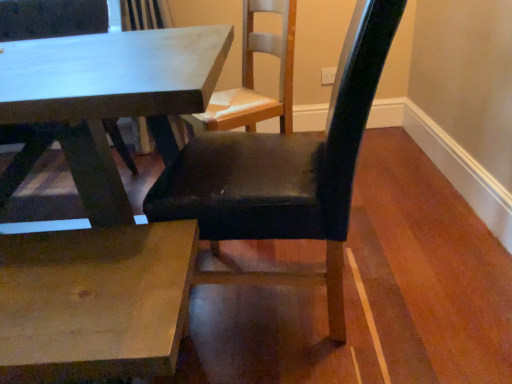
Question: Should I look upward or downward to see smooth white table at center?

Choices:
 (A) down
 (B) up

Answer: (B)

Question: Does black leather chair at center have a lesser height compared to smooth white table at center?

Choices:
 (A) yes
 (B) no

Answer: (B)

Question: From the image's perspective, does black leather chair at center appear lower than smooth white table at center?

Choices:
 (A) no
 (B) yes

Answer: (A)

Question: Is black leather chair at center at the right side of smooth white table at center?

Choices:
 (A) yes
 (B) no

Answer: (A)

Question: Is smooth white table at center at the back of black leather chair at center?

Choices:
 (A) yes
 (B) no

Answer: (B)

Question: Is black leather chair at center taller than smooth white table at center?

Choices:
 (A) no
 (B) yes

Answer: (B)

Question: Can you confirm if black leather chair at center is wider than smooth white table at center?

Choices:
 (A) no
 (B) yes

Answer: (A)

Question: Is smooth white table at center bigger than black leather chair at center?

Choices:
 (A) yes
 (B) no

Answer: (A)

Question: Is smooth white table at center to the right of black leather chair at center from the viewer's perspective?

Choices:
 (A) no
 (B) yes

Answer: (A)

Question: From the image's perspective, is smooth white table at center located above black leather chair at center?

Choices:
 (A) yes
 (B) no

Answer: (B)

Question: Is the position of smooth white table at center more distant than that of black leather chair at center?

Choices:
 (A) no
 (B) yes

Answer: (B)

Question: Would you say smooth white table at center is outside black leather chair at center?

Choices:
 (A) no
 (B) yes

Answer: (B)

Question: Does smooth white table at center have a smaller size compared to black leather chair at center?

Choices:
 (A) no
 (B) yes

Answer: (A)

Question: Is black leather chair at center spatially inside smooth white table at center, or outside of it?

Choices:
 (A) outside
 (B) inside

Answer: (A)